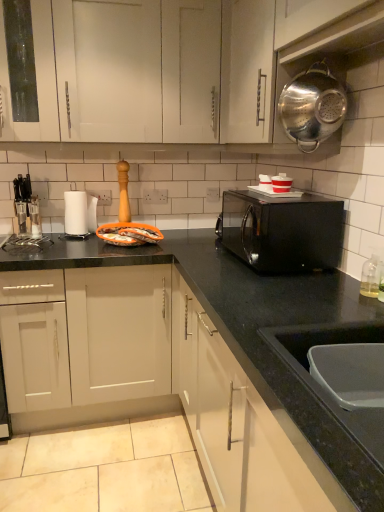
Identify the location of free space in front of white glossy cup at upper center, the 2th appliance viewed from the back. The height and width of the screenshot is (512, 384). 289,199.